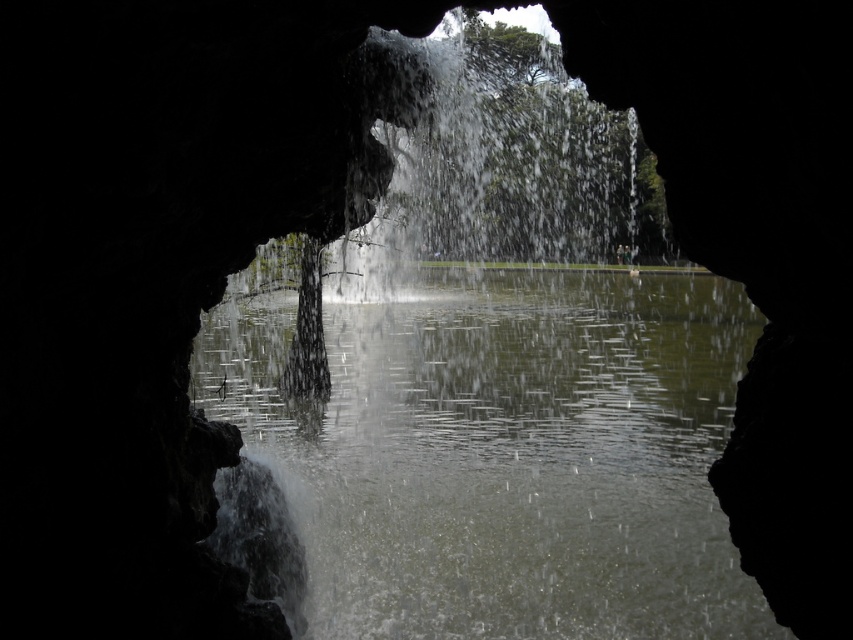
Question: Can you confirm if clear water at center is positioned to the right of white frothy water at center?

Choices:
 (A) no
 (B) yes

Answer: (A)

Question: Which of the following is the farthest from the observer?

Choices:
 (A) white frothy water at center
 (B) clear water at center

Answer: (B)

Question: Is clear water at center thinner than white frothy water at center?

Choices:
 (A) yes
 (B) no

Answer: (B)

Question: Does clear water at center appear on the right side of white frothy water at center?

Choices:
 (A) yes
 (B) no

Answer: (B)

Question: Which object appears farthest from the camera in this image?

Choices:
 (A) clear water at center
 (B) white frothy water at center

Answer: (A)

Question: Which point appears farthest from the camera in this image?

Choices:
 (A) (512, 198)
 (B) (296, 497)

Answer: (A)